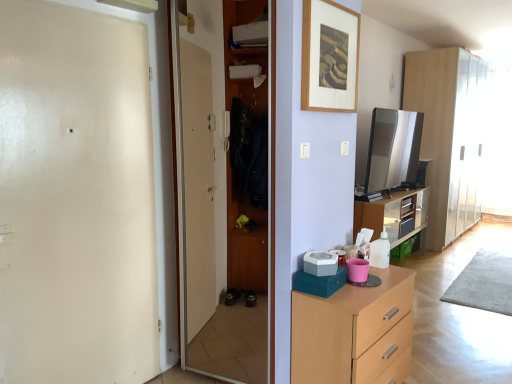
What do you see at coordinates (329, 57) in the screenshot? Image resolution: width=512 pixels, height=384 pixels. I see `wooden picture frame at upper center` at bounding box center [329, 57].

What do you see at coordinates (393, 215) in the screenshot? I see `matte plastic file cabinet at center right` at bounding box center [393, 215].

Measure the distance between point (425, 212) and camera.

Point (425, 212) and camera are 5.54 meters apart from each other.

How much space does satin silver tv at upper right, marked as the 2th appliance in a left-to-right arrangement, occupy horizontally?

It is 3.67 inches.

Find the location of a particular element. This screenshot has height=384, width=512. satin silver tv at upper right, marked as the 1th appliance in a back-to-front arrangement is located at coordinates (393, 149).

The height and width of the screenshot is (384, 512). In order to click on white plastic pet feeder at center, arranged as the second appliance when viewed from the right in this screenshot , I will do `click(320, 263)`.

The width and height of the screenshot is (512, 384). Describe the element at coordinates (320, 263) in the screenshot. I see `white plastic pet feeder at center, the first appliance viewed from the front` at that location.

What is the approximate height of light wood cupboard at right?

The height of light wood cupboard at right is 7.84 feet.

Where is `light wood cupboard at right`? light wood cupboard at right is located at coordinates (449, 136).

I want to click on light wood chest of drawers at lower right, so click(355, 332).

The height and width of the screenshot is (384, 512). Identify the location of white glossy door at left, which is counted as the 1th screen door, starting from the left. (75, 197).

Which of these two, white plastic pet feeder at center, the first appliance viewed from the front, or light wood cupboard at right, is smaller?

Smaller between the two is white plastic pet feeder at center, the first appliance viewed from the front.

Considering the points (317, 274) and (412, 68), which point is in front, point (317, 274) or point (412, 68)?

Positioned in front is point (317, 274).

Find the location of a particular element. The image size is (512, 384). cupboard located above the white plastic pet feeder at center, the first appliance viewed from the front (from a real-world perspective) is located at coordinates (449, 136).

Considering the relative positions of white plastic pet feeder at center, the first appliance viewed from the front, and light wood cupboard at right in the image provided, is white plastic pet feeder at center, the first appliance viewed from the front, to the left of light wood cupboard at right from the viewer's perspective?

Indeed, white plastic pet feeder at center, the first appliance viewed from the front, is positioned on the left side of light wood cupboard at right.

What's the angular difference between wooden wardrobe at center, acting as the 2th screen door starting from the left, and satin silver tv at upper right, which appears as the 1th appliance when viewed from the top,'s facing directions?

91.3 degrees separate the facing orientations of wooden wardrobe at center, acting as the 2th screen door starting from the left, and satin silver tv at upper right, which appears as the 1th appliance when viewed from the top.

Is wooden wardrobe at center, acting as the 2th screen door starting from the left, facing away from satin silver tv at upper right, placed as the second appliance when sorted from bottom to top?

Yes.

From a real-world perspective, is wooden wardrobe at center, acting as the 2th screen door starting from the left, below satin silver tv at upper right, which appears as the 1th appliance when viewed from the top?

Yes.

Is point (238, 56) positioned in front of point (395, 122)?

Yes, it is in front of point (395, 122).

From the image's perspective, which one is positioned higher, light wood chest of drawers at lower right or light wood cupboard at right?

light wood cupboard at right is shown above in the image.

Does light wood chest of drawers at lower right have a lesser height compared to light wood cupboard at right?

Indeed, light wood chest of drawers at lower right has a lesser height compared to light wood cupboard at right.

Is light wood chest of drawers at lower right bigger than light wood cupboard at right?

No, light wood chest of drawers at lower right is not bigger than light wood cupboard at right.

Considering their positions, is light wood chest of drawers at lower right located in front of or behind light wood cupboard at right?

light wood chest of drawers at lower right is in front of light wood cupboard at right.

From the image's perspective, is wooden picture frame at upper center below matte plastic file cabinet at center right?

No, from the image's perspective, wooden picture frame at upper center is not below matte plastic file cabinet at center right.

Considering the sizes of wooden picture frame at upper center and matte plastic file cabinet at center right in the image, is wooden picture frame at upper center taller or shorter than matte plastic file cabinet at center right?

Considering their sizes, wooden picture frame at upper center has less height than matte plastic file cabinet at center right.

Is wooden picture frame at upper center positioned beyond the bounds of matte plastic file cabinet at center right?

Yes, wooden picture frame at upper center is not within matte plastic file cabinet at center right.

From the image's perspective, is light wood chest of drawers at lower right on top of matte plastic file cabinet at center right?

No, from the image's perspective, light wood chest of drawers at lower right is not on top of matte plastic file cabinet at center right.

Can you confirm if light wood chest of drawers at lower right is taller than matte plastic file cabinet at center right?

In fact, light wood chest of drawers at lower right may be shorter than matte plastic file cabinet at center right.

What are the coordinates of `the chest of drawers below the matte plastic file cabinet at center right (from a real-world perspective)` in the screenshot? It's located at (355, 332).

Is there a large distance between light wood chest of drawers at lower right and matte plastic file cabinet at center right?

Indeed, light wood chest of drawers at lower right is not near matte plastic file cabinet at center right.

Between white plastic pet feeder at center, the first appliance viewed from the front, and matte plastic file cabinet at center right, which one appears on the right side from the viewer's perspective?

matte plastic file cabinet at center right.

Considering the relative sizes of white plastic pet feeder at center, positioned as the 2th appliance in back-to-front order, and matte plastic file cabinet at center right in the image provided, is white plastic pet feeder at center, positioned as the 2th appliance in back-to-front order, shorter than matte plastic file cabinet at center right?

Indeed, white plastic pet feeder at center, positioned as the 2th appliance in back-to-front order, has a lesser height compared to matte plastic file cabinet at center right.

Is white plastic pet feeder at center, positioned as the 1th appliance in bottom-to-top order, in front of or behind matte plastic file cabinet at center right in the image?

white plastic pet feeder at center, positioned as the 1th appliance in bottom-to-top order, is in front of matte plastic file cabinet at center right.

How far apart are white plastic pet feeder at center, which appears as the 1th appliance when viewed from the left, and matte plastic file cabinet at center right?

The distance of white plastic pet feeder at center, which appears as the 1th appliance when viewed from the left, from matte plastic file cabinet at center right is 2.18 meters.

Identify the location of cupboard located on the right of satin silver tv at upper right, placed as the second appliance when sorted from bottom to top. The width and height of the screenshot is (512, 384). (449, 136).

Is light wood cupboard at right not inside satin silver tv at upper right, marked as the 1th appliance in a back-to-front arrangement?

light wood cupboard at right is positioned outside satin silver tv at upper right, marked as the 1th appliance in a back-to-front arrangement.

From the image's perspective, is light wood cupboard at right positioned above or below satin silver tv at upper right, arranged as the second appliance when viewed from the front?

Based on their image positions, light wood cupboard at right is located above satin silver tv at upper right, arranged as the second appliance when viewed from the front.

Would you say light wood cupboard at right is to the left or to the right of satin silver tv at upper right, which appears as the 1th appliance when viewed from the top, in the picture?

light wood cupboard at right is to the right of satin silver tv at upper right, which appears as the 1th appliance when viewed from the top.

Where is `cupboard on the right of white plastic pet feeder at center, which appears as the 1th appliance when viewed from the left`? This screenshot has height=384, width=512. cupboard on the right of white plastic pet feeder at center, which appears as the 1th appliance when viewed from the left is located at coordinates (449, 136).

The width and height of the screenshot is (512, 384). Identify the location of the 1st screen door below the satin silver tv at upper right, marked as the 1th appliance in a back-to-front arrangement (from the image's perspective). (226, 207).

From the image, which object appears to be nearer to light wood chest of drawers at lower right, wooden picture frame at upper center or white plastic pet feeder at center, positioned as the 1th appliance in bottom-to-top order?

white plastic pet feeder at center, positioned as the 1th appliance in bottom-to-top order, is closer to light wood chest of drawers at lower right.

From the image, which object appears to be nearer to white plastic pet feeder at center, positioned as the 1th appliance in bottom-to-top order, light wood chest of drawers at lower right or white glossy door at left, the 2th screen door positioned from the right?

The object closer to white plastic pet feeder at center, positioned as the 1th appliance in bottom-to-top order, is light wood chest of drawers at lower right.

From the image, which object appears to be nearer to wooden wardrobe at center, which is counted as the first screen door, starting from the right, wooden picture frame at upper center or white glossy door at left, the 2th screen door positioned from the right?

white glossy door at left, the 2th screen door positioned from the right.

Which object lies further to the anchor point white plastic pet feeder at center, which appears as the 1th appliance when viewed from the left, wooden picture frame at upper center or light wood chest of drawers at lower right?

Based on the image, wooden picture frame at upper center appears to be further to white plastic pet feeder at center, which appears as the 1th appliance when viewed from the left.

Considering their positions, is white plastic pet feeder at center, which is the second appliance from top to bottom, positioned further to white glossy door at left, the 2th screen door positioned from the right, than satin silver tv at upper right, marked as the 1th appliance in a back-to-front arrangement?

Among the two, satin silver tv at upper right, marked as the 1th appliance in a back-to-front arrangement, is located further to white glossy door at left, the 2th screen door positioned from the right.

Based on their spatial positions, is white plastic pet feeder at center, which appears as the 1th appliance when viewed from the left, or white glossy door at left, the 2th screen door positioned from the right, closer to satin silver tv at upper right, which is the first appliance in right-to-left order?

Among the two, white plastic pet feeder at center, which appears as the 1th appliance when viewed from the left, is located nearer to satin silver tv at upper right, which is the first appliance in right-to-left order.

Considering their positions, is white glossy door at left, which is counted as the 1th screen door, starting from the left, positioned further to wooden wardrobe at center, acting as the 2th screen door starting from the left, than white plastic pet feeder at center, positioned as the 2th appliance in back-to-front order?

white plastic pet feeder at center, positioned as the 2th appliance in back-to-front order, is further to wooden wardrobe at center, acting as the 2th screen door starting from the left.

From the image, which object appears to be farther from light wood cupboard at right, white glossy door at left, the 2th screen door positioned from the right, or satin silver tv at upper right, marked as the 1th appliance in a back-to-front arrangement?

The object further to light wood cupboard at right is white glossy door at left, the 2th screen door positioned from the right.

The image size is (512, 384). Identify the location of picture frame between wooden wardrobe at center, acting as the 2th screen door starting from the left, and matte plastic file cabinet at center right from front to back. (329, 57).

Where is `file cabinet between wooden picture frame at upper center and light wood cupboard at right from front to back`? The width and height of the screenshot is (512, 384). file cabinet between wooden picture frame at upper center and light wood cupboard at right from front to back is located at coordinates (393, 215).

This screenshot has height=384, width=512. In order to click on screen door between white glossy door at left, which is counted as the 1th screen door, starting from the left, and wooden picture frame at upper center, in the horizontal direction in this screenshot , I will do `click(226, 207)`.

Image resolution: width=512 pixels, height=384 pixels. Find the location of `appliance between wooden wardrobe at center, acting as the 2th screen door starting from the left, and light wood chest of drawers at lower right from left to right`. appliance between wooden wardrobe at center, acting as the 2th screen door starting from the left, and light wood chest of drawers at lower right from left to right is located at coordinates (320, 263).